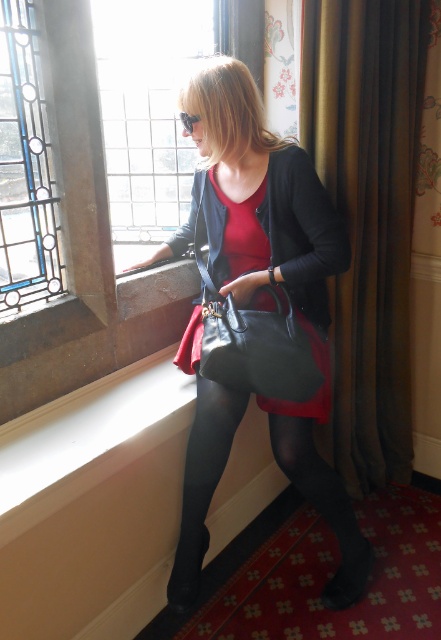
You are an interior designer planning to hang a picture frame exactly where the matte black handbag at center is currently positioned. What are the coordinates where you should place the frame?

The coordinates for the matte black handbag at center are at point (x=276, y=275), so you should place the picture frame at those coordinates.

A customer is trying to decide between buying the matte black dress at center and the black leather handbag at center. They want to know which item takes up more space when stored. Based on the image, which item should they choose if they prioritize space efficiency?

The matte black dress at center is bigger than the black leather handbag at center, so the handbag takes up less space. If prioritizing space efficiency, the customer should choose the black leather handbag at center.

You are a fashion designer visiting a traditional room and see the stained glass window at left and the matte black dress at center. Which object is positioned to the right side of the room?

The matte black dress at center is positioned to the right side of the room since it is to the right of the stained glass window at left.